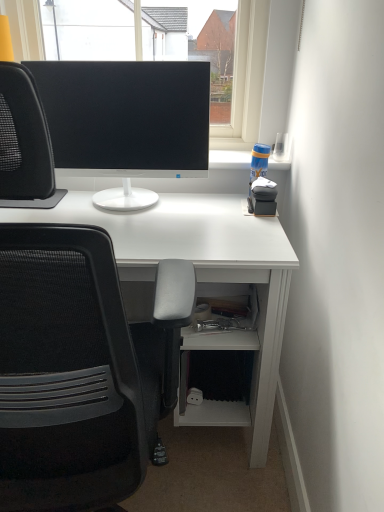
The width and height of the screenshot is (384, 512). I want to click on vacant space in matte black monitor at center (from a real-world perspective), so click(157, 201).